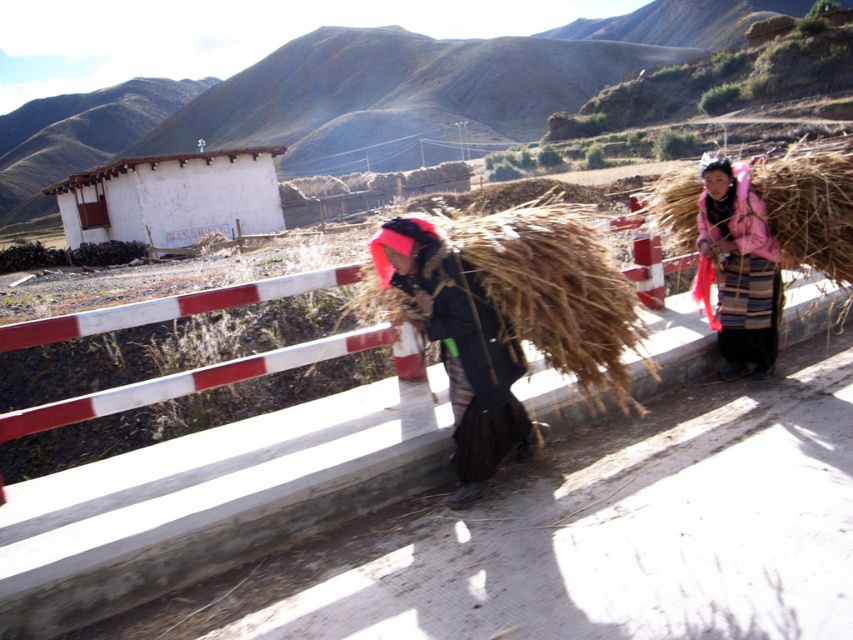
Question: Which of the following is the farthest from the observer?

Choices:
 (A) brown straw at right
 (B) dark brown fabric at center

Answer: (A)

Question: Does white painted wood hut at upper left have a smaller size compared to brown straw at right?

Choices:
 (A) yes
 (B) no

Answer: (B)

Question: Which object is farther from the camera taking this photo?

Choices:
 (A) pink woolen jacket at right
 (B) dark brown fabric at center
 (C) white painted wood hut at upper left

Answer: (C)

Question: Which of the following is the farthest from the observer?

Choices:
 (A) white painted wood hut at upper left
 (B) dark brown fabric at center
 (C) pink woolen jacket at right
 (D) brown straw at right

Answer: (A)

Question: Can you confirm if white painted wood hut at upper left is bigger than pink woolen jacket at right?

Choices:
 (A) yes
 (B) no

Answer: (A)

Question: Is white painted wood hut at upper left above pink woolen jacket at right?

Choices:
 (A) yes
 (B) no

Answer: (A)